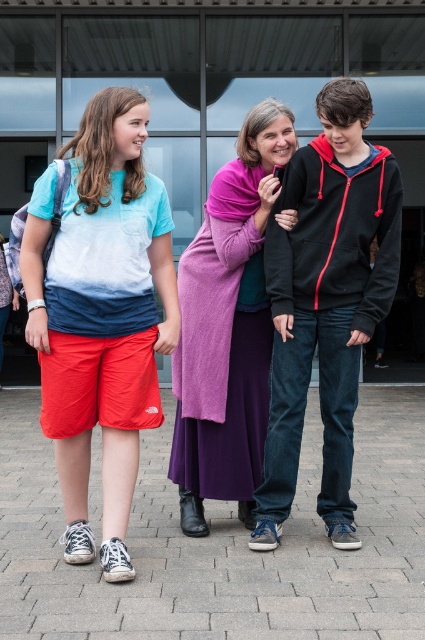
Is dyed cotton shorts at left further to camera compared to black zip-up hoodie at center?

That is False.

Who is positioned more to the right, dyed cotton shorts at left or black zip-up hoodie at center?

black zip-up hoodie at center is more to the right.

Describe the element at coordinates (101, 314) in the screenshot. I see `dyed cotton shorts at left` at that location.

At what (x,y) coordinates should I click in order to perform the action: click on dyed cotton shorts at left. Please return your answer as a coordinate pair (x, y). The image size is (425, 640). Looking at the image, I should click on click(101, 314).

Can you confirm if black zip-up hoodie at center is thinner than purple knit sweater at center?

Incorrect, black zip-up hoodie at center's width is not less than purple knit sweater at center's.

Is black zip-up hoodie at center below purple knit sweater at center?

Actually, black zip-up hoodie at center is above purple knit sweater at center.

Who is more forward, (371, 177) or (209, 477)?

Positioned in front is point (371, 177).

Where is `black zip-up hoodie at center`? black zip-up hoodie at center is located at coordinates (325, 301).

Between point (28, 400) and point (223, 456), which one is positioned behind?

The point (28, 400) is more distant.

Is brick pavement at center further to the viewer compared to purple knit sweater at center?

No, it is not.

In order to click on brick pavement at center in this screenshot , I will do `click(221, 544)`.